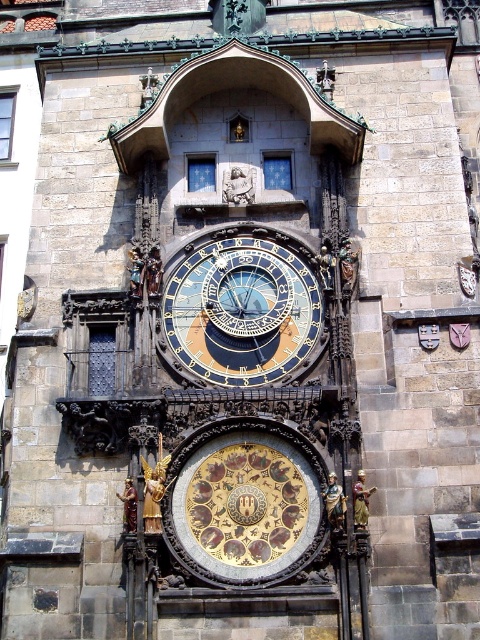
How far apart are gold/gilded/astrological clock at center and gold metallic clock at center?

gold/gilded/astrological clock at center and gold metallic clock at center are 8.45 meters apart.

Which of these two, gold/gilded/astrological clock at center or gold metallic clock at center, stands taller?

gold metallic clock at center

Between point (206, 554) and point (300, 342), which one is positioned behind?

Positioned behind is point (300, 342).

This screenshot has width=480, height=640. I want to click on gold/gilded/astrological clock at center, so click(x=243, y=502).